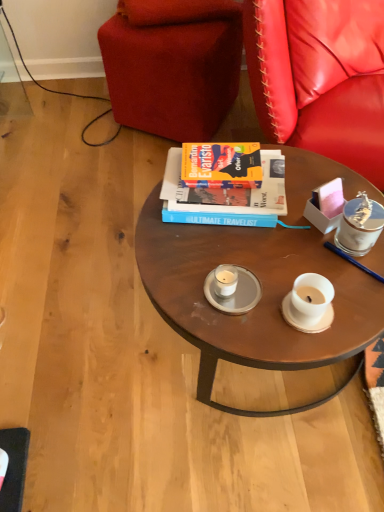
Image resolution: width=384 pixels, height=512 pixels. In order to click on free space in front of clear glass saucer at center in this screenshot , I will do `click(251, 337)`.